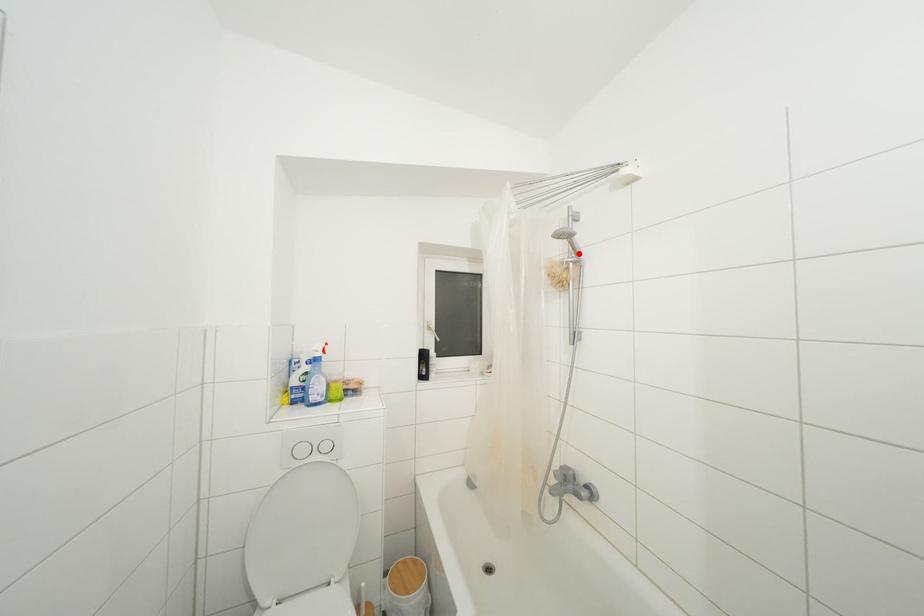
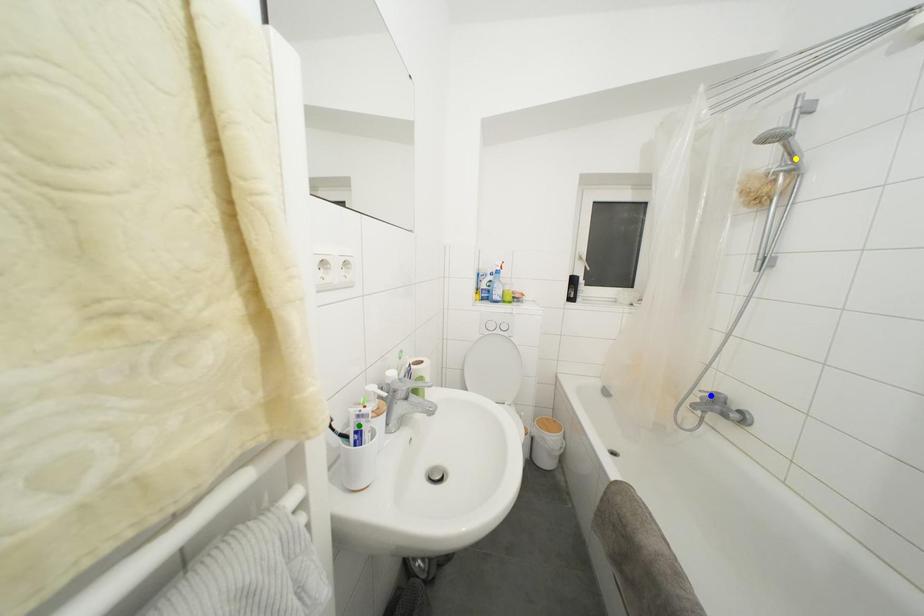
Question: I am providing you with two images of the same scene from different viewpoints. A red point is marked on the first image. You are given multiple points on the second image. Which point in image 2 is actually the same real-world point as the red point in image 1?

Choices:
 (A) blue point
 (B) green point
 (C) yellow point

Answer: (C)